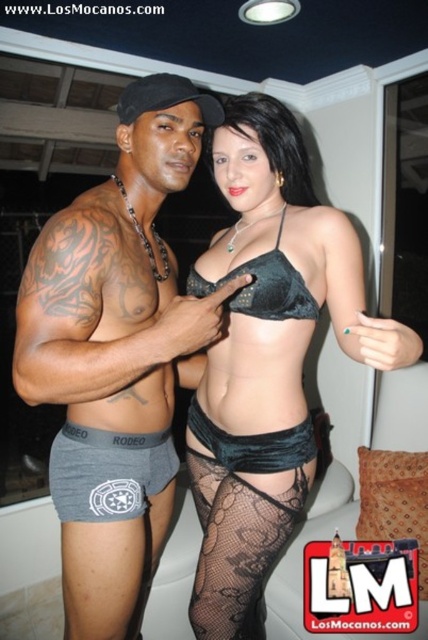
Question: Does gray cotton boxer briefs at lower left lie behind velvet black bikini top at center?

Choices:
 (A) yes
 (B) no

Answer: (A)

Question: Which object appears closest to the camera in this image?

Choices:
 (A) gray cotton underwear at center
 (B) black lace stockings at lower center

Answer: (A)

Question: Does velvet black lingerie at center appear on the right side of black lace stockings at lower center?

Choices:
 (A) no
 (B) yes

Answer: (B)

Question: Is velvet black lingerie at center closer to the viewer compared to gray cotton boxer briefs at lower left?

Choices:
 (A) yes
 (B) no

Answer: (A)

Question: Which of these objects is positioned farthest from the black lace stockings at lower center?

Choices:
 (A) gray cotton boxer briefs at lower left
 (B) velvet black lingerie at center
 (C) gray cotton underwear at center
 (D) velvet black bikini top at center

Answer: (D)

Question: Which of the following is the closest to the observer?

Choices:
 (A) (x=273, y=467)
 (B) (x=210, y=124)

Answer: (A)